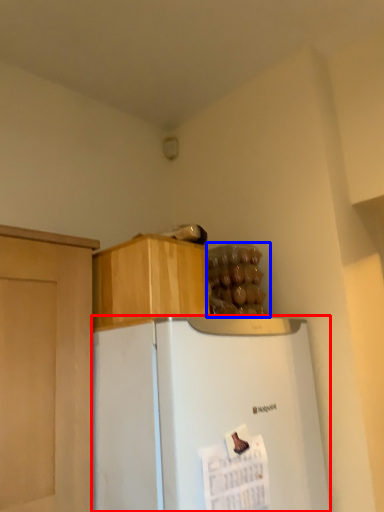
Question: Which point is closer to the camera, refrigerator (highlighted by a red box) or food (highlighted by a blue box)?

Choices:
 (A) refrigerator
 (B) food

Answer: (A)